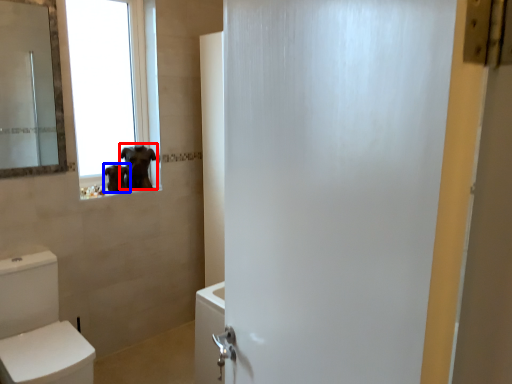
Question: Which object is further to the camera taking this photo, animal (highlighted by a red box) or animal (highlighted by a blue box)?

Choices:
 (A) animal
 (B) animal

Answer: (A)